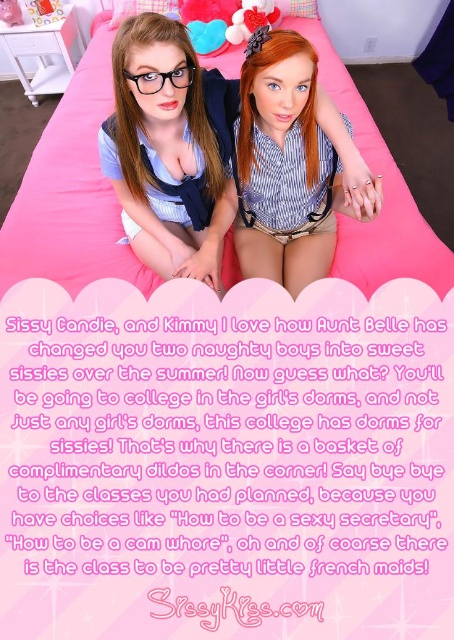
Question: Which object appears closest to the camera in this image?

Choices:
 (A) striped fabric shirt at center
 (B) matte pink heart at upper center

Answer: (A)

Question: Among these objects, which one is nearest to the camera?

Choices:
 (A) matte blue shirt at center
 (B) striped fabric shirt at center
 (C) matte pink heart at upper center

Answer: (A)

Question: Among these points, which one is farthest from the camera?

Choices:
 (A) (177, 52)
 (B) (376, 189)

Answer: (B)

Question: Is the position of pink fabric bed at center more distant than that of striped fabric shirt at center?

Choices:
 (A) no
 (B) yes

Answer: (B)

Question: From the image, what is the correct spatial relationship of pink fabric bed at center in relation to matte blue shirt at center?

Choices:
 (A) right
 (B) left

Answer: (B)

Question: Does matte blue shirt at center have a lesser width compared to striped fabric shirt at center?

Choices:
 (A) no
 (B) yes

Answer: (A)